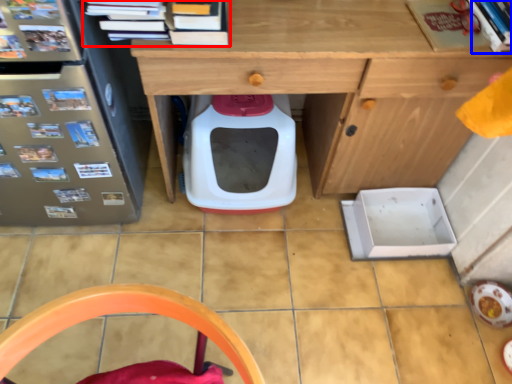
Question: Which object appears closest to the camera in this image, book (highlighted by a red box) or book (highlighted by a blue box)?

Choices:
 (A) book
 (B) book

Answer: (A)